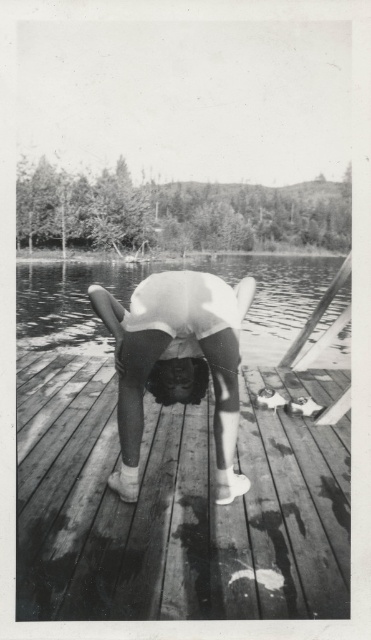
You are standing at the edge of the wooden dock in the image. There is a point labeled as point [176,504]. Where is this point located relative to the wooden dock?

The point [176,504] is located at the center of the wooden dock.

In the scene shown: You are a photographer who wants to capture the wooden at center and transparent water at center in a single frame. Based on their heights, which object should you focus on first to ensure both are in the shot?

The wooden at center is shorter than transparent water at center. To ensure both are in the shot, focus on the wooden at center first as it is lower and adjust the camera angle to include the taller transparent water at center.